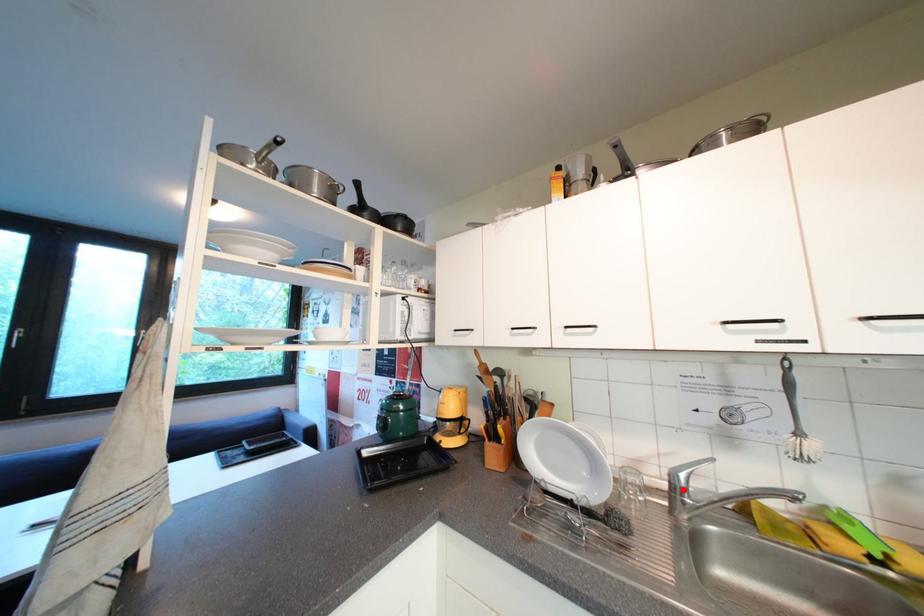
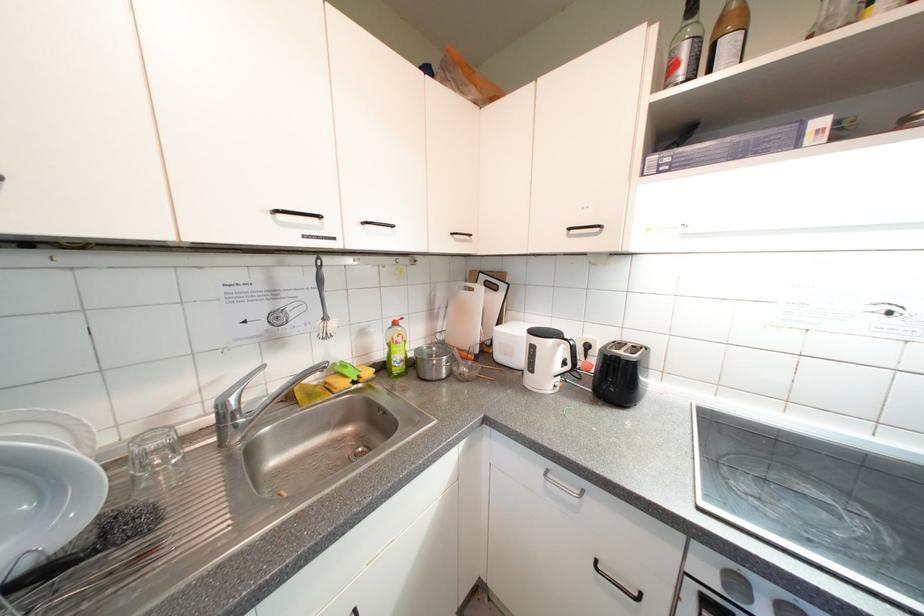
The point at the highlighted location is marked in the first image. Where is the corresponding point in the second image?

(233, 419)